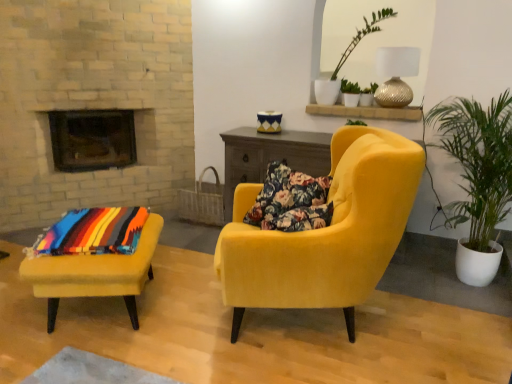
Where is `unoccupied region to the right of velvet yellow ottoman at lower left, which is the 2th chair in right-to-left order`? unoccupied region to the right of velvet yellow ottoman at lower left, which is the 2th chair in right-to-left order is located at coordinates (196, 317).